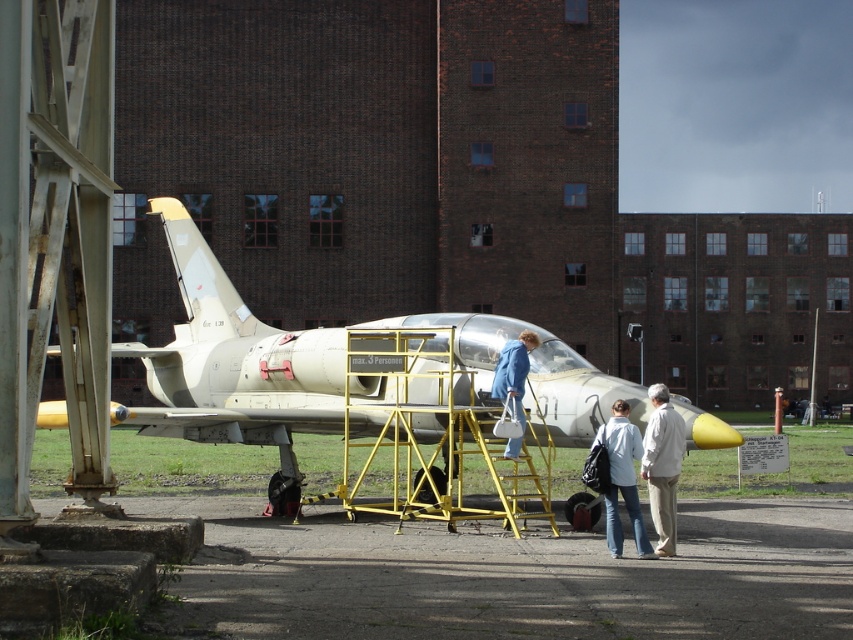
Is white cotton shirt at lower right taller than light blue denim jacket at center?

Yes, white cotton shirt at lower right is taller than light blue denim jacket at center.

Between white cotton shirt at lower right and light blue denim jacket at center, which one is positioned higher?

white cotton shirt at lower right is above.

Which is behind, point (656, 522) or point (607, 449)?

Point (607, 449)

The height and width of the screenshot is (640, 853). What are the coordinates of `white cotton shirt at lower right` in the screenshot? It's located at (662, 465).

Is concrete tarmac at lower center to the right of matte white airplane at center from the viewer's perspective?

Correct, you'll find concrete tarmac at lower center to the right of matte white airplane at center.

This screenshot has height=640, width=853. Identify the location of concrete tarmac at lower center. (515, 576).

Is concrete tarmac at lower center below blue denim jacket at center?

Indeed, concrete tarmac at lower center is positioned under blue denim jacket at center.

Between point (347, 572) and point (515, 362), which one is positioned in front?

Point (347, 572) is more forward.

Is point (560, 596) positioned behind point (524, 332)?

No.

You are a GUI agent. You are given a task and a screenshot of the screen. Output one action in this format:
    pyautogui.click(x=<x>, y=<y>)
    Task: Click on the concrete tarmac at lower center
    
    Given the screenshot: What is the action you would take?
    pyautogui.click(x=515, y=576)